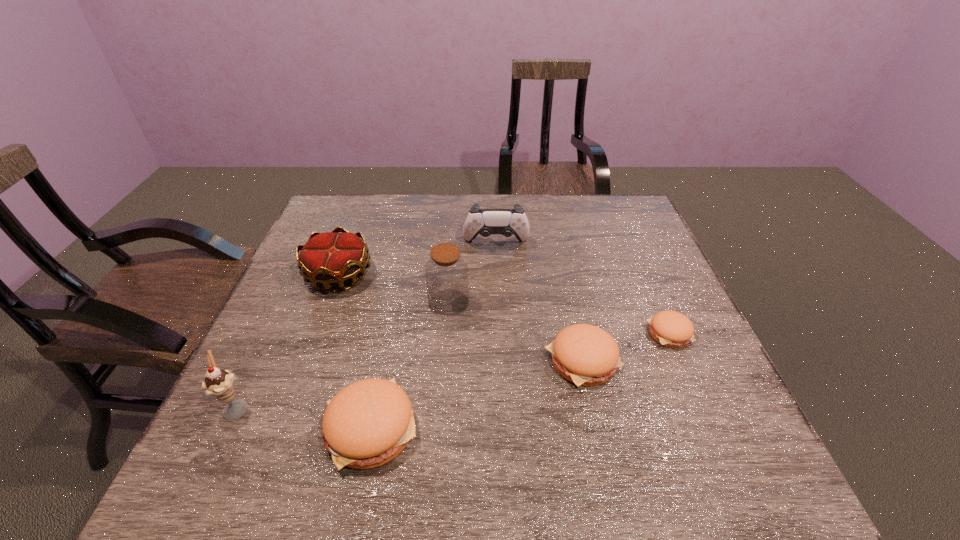
Where is `vacant point located 0.050m on the right of the leftmost patty`? This screenshot has height=540, width=960. vacant point located 0.050m on the right of the leftmost patty is located at coordinates [445, 428].

The width and height of the screenshot is (960, 540). Identify the location of free space located on the back of the sixth tallest object. (564, 280).

Locate an element on the screen. free space located 0.220m on the back of the rightmost object is located at coordinates (638, 262).

The height and width of the screenshot is (540, 960). What are the coordinates of `free region located on the right of the fourth shortest object` in the screenshot? It's located at (497, 275).

I want to click on free location located 0.100m on the front-facing side of the control, so click(497, 275).

Where is `free space located on the back of the jar`? The height and width of the screenshot is (540, 960). free space located on the back of the jar is located at coordinates (453, 238).

You are a GUI agent. You are given a task and a screenshot of the screen. Output one action in this format:
    pyautogui.click(x=<x>, y=<y>)
    Task: Click on the vacant space positioned on the right of the icecream
    This screenshot has height=540, width=960.
    Given the screenshot: What is the action you would take?
    [x=395, y=407]

You are a GUI agent. You are given a task and a screenshot of the screen. Output one action in this format:
    pyautogui.click(x=<x>, y=<y>)
    Task: Click on the patty at the near edge
    The image size is (960, 540).
    Given the screenshot: What is the action you would take?
    pyautogui.click(x=368, y=423)

Locate an element on the screen. icecream situated at the near edge is located at coordinates (219, 383).

Locate an element on the screen. The height and width of the screenshot is (540, 960). crown located at the left edge is located at coordinates (331, 258).